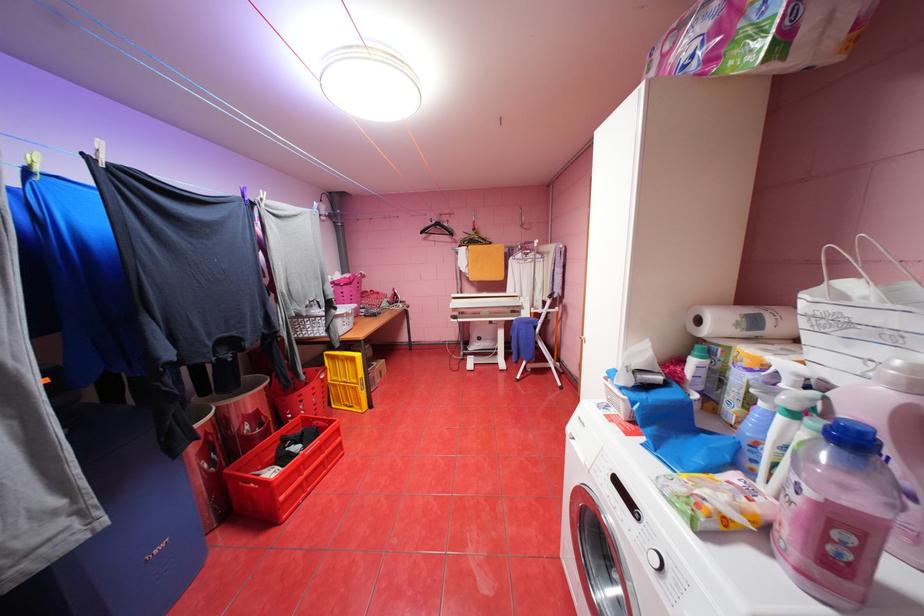
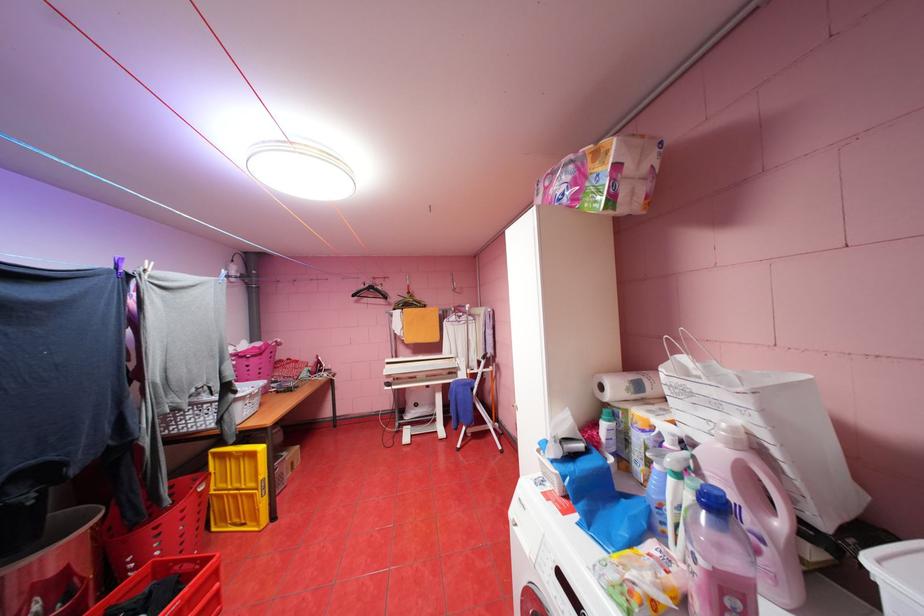
In the second image, find the point that corresponds to pixel 862 540 in the first image.

(748, 604)